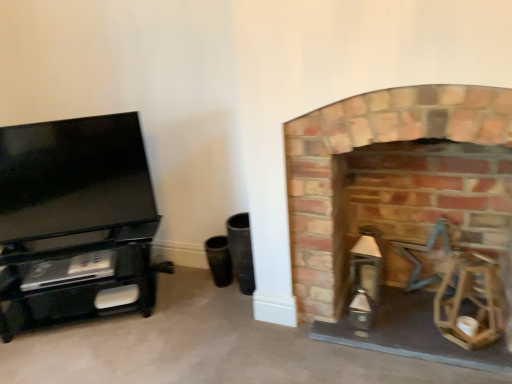
In order to face black glossy tv stand at left, should I rotate leftwards or rightwards?

Rotate left and turn 24.007 degrees.

What do you see at coordinates (75, 221) in the screenshot? I see `black glossy tv stand at left` at bounding box center [75, 221].

What are the coordinates of `black glossy tv stand at left` in the screenshot? It's located at (75, 221).

The image size is (512, 384). What do you see at coordinates (397, 204) in the screenshot?
I see `brick fireplace at right` at bounding box center [397, 204].

At what (x,y) coordinates should I click in order to perform the action: click on brick fireplace at right. Please return your answer as a coordinate pair (x, y). Looking at the image, I should click on (397, 204).

The width and height of the screenshot is (512, 384). I want to click on black glossy tv stand at left, so click(x=75, y=221).

Is black glossy tv stand at left at the left side of brick fireplace at right?

Yes.

Which object is further away from the camera taking this photo, black glossy tv stand at left or brick fireplace at right?

black glossy tv stand at left.

Does point (123, 159) come in front of point (428, 191)?

No, it is behind (428, 191).

From the image's perspective, is black glossy tv stand at left located above or below brick fireplace at right?

black glossy tv stand at left is situated higher than brick fireplace at right in the image.

Consider the image. From a real-world perspective, is black glossy tv stand at left located higher than brick fireplace at right?

Yes, from a real-world perspective, black glossy tv stand at left is on top of brick fireplace at right.

Does black glossy tv stand at left have a greater width compared to brick fireplace at right?

Incorrect, the width of black glossy tv stand at left does not surpass that of brick fireplace at right.

Does black glossy tv stand at left have a lesser height compared to brick fireplace at right?

Yes, black glossy tv stand at left is shorter than brick fireplace at right.

Considering the sizes of objects black glossy tv stand at left and brick fireplace at right in the image provided, who is bigger, black glossy tv stand at left or brick fireplace at right?

With larger size is brick fireplace at right.

Is black glossy tv stand at left inside the boundaries of brick fireplace at right, or outside?

The correct answer is: outside.

Does black glossy tv stand at left touch brick fireplace at right?

No, black glossy tv stand at left is not next to brick fireplace at right.

Is brick fireplace at right at the back of black glossy tv stand at left?

No, black glossy tv stand at left is not facing away from brick fireplace at right.

Image resolution: width=512 pixels, height=384 pixels. In order to click on entertainment center located above the brick fireplace at right (from the image's perspective) in this screenshot , I will do `click(75, 221)`.

Considering the positions of objects brick fireplace at right and black glossy tv stand at left in the image provided, who is more to the left, brick fireplace at right or black glossy tv stand at left?

black glossy tv stand at left is more to the left.

Relative to black glossy tv stand at left, is brick fireplace at right in front or behind?

brick fireplace at right is positioned closer to the viewer than black glossy tv stand at left.

Is point (297, 270) less distant than point (24, 247)?

Yes, point (297, 270) is closer to viewer.

From the image's perspective, between brick fireplace at right and black glossy tv stand at left, who is located below?

brick fireplace at right.

From a real-world perspective, does brick fireplace at right stand above black glossy tv stand at left?

Incorrect, from a real-world perspective, brick fireplace at right is lower than black glossy tv stand at left.

From the picture: In terms of width, does brick fireplace at right look wider or thinner when compared to black glossy tv stand at left?

In the image, brick fireplace at right appears to be wider than black glossy tv stand at left.

In terms of height, does brick fireplace at right look taller or shorter compared to black glossy tv stand at left?

Clearly, brick fireplace at right is taller compared to black glossy tv stand at left.

Considering the relative sizes of brick fireplace at right and black glossy tv stand at left in the image provided, is brick fireplace at right smaller than black glossy tv stand at left?

No, brick fireplace at right is not smaller than black glossy tv stand at left.

Is brick fireplace at right outside of black glossy tv stand at left?

Indeed, brick fireplace at right is completely outside black glossy tv stand at left.

Is there a large distance between brick fireplace at right and black glossy tv stand at left?

Yes, brick fireplace at right and black glossy tv stand at left are located far from each other.

Is brick fireplace at right oriented away from black glossy tv stand at left?

No, brick fireplace at right is not facing away from black glossy tv stand at left.

How different are the orientations of brick fireplace at right and black glossy tv stand at left in degrees?

There is a 31.4-degree angle between the facing directions of brick fireplace at right and black glossy tv stand at left.

Identify the location of fireplace on the right of the black glossy tv stand at left. (397, 204).

The width and height of the screenshot is (512, 384). Find the location of `entertainment center above the brick fireplace at right (from a real-world perspective)`. entertainment center above the brick fireplace at right (from a real-world perspective) is located at coordinates (75, 221).

Identify the location of fireplace on the right of black glossy tv stand at left. (397, 204).